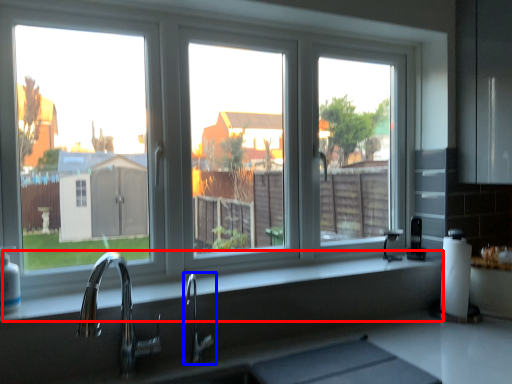
Question: Which object is closer to the camera taking this photo, counter top (highlighted by a red box) or tap (highlighted by a blue box)?

Choices:
 (A) counter top
 (B) tap

Answer: (A)